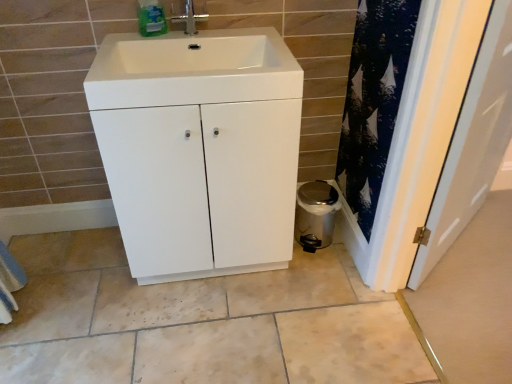
Find the location of `vacant space underneath white glossy door at right (from a real-world perspective)`. vacant space underneath white glossy door at right (from a real-world perspective) is located at coordinates (453, 250).